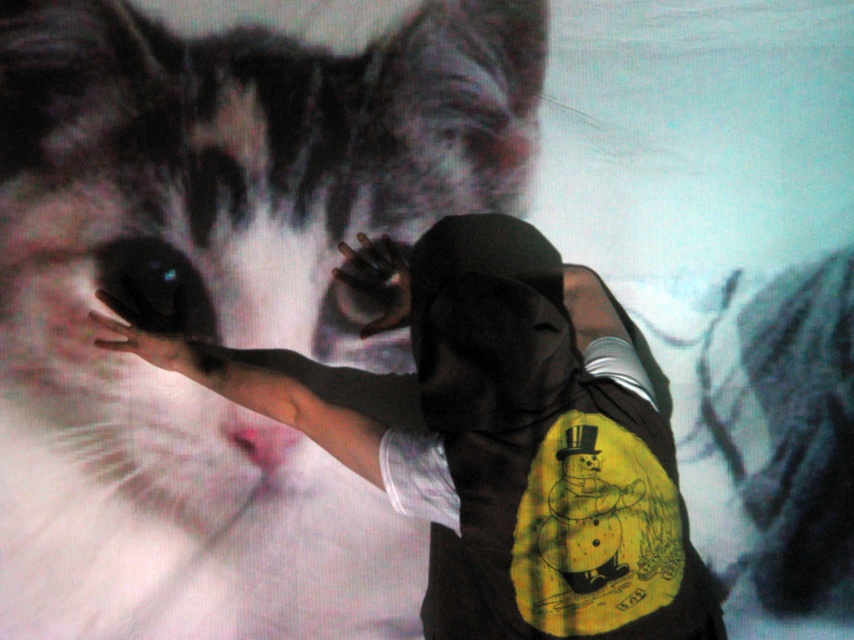
Question: Can you confirm if black matte hand at center is positioned to the right of black matte glove at center?

Choices:
 (A) no
 (B) yes

Answer: (B)

Question: Can you confirm if black matte hand at center is positioned to the left of black matte glove at center?

Choices:
 (A) no
 (B) yes

Answer: (A)

Question: Considering the real-world distances, which object is closest to the gray textured fur at upper right?

Choices:
 (A) black matte t-shirt at center
 (B) black matte glove at center

Answer: (A)

Question: Considering the relative positions of black matte t-shirt at center and black matte glove at center in the image provided, where is black matte t-shirt at center located with respect to black matte glove at center?

Choices:
 (A) right
 (B) left

Answer: (A)

Question: Which of the following is the farthest from the observer?

Choices:
 (A) black matte hand at center
 (B) gray textured fur at upper right
 (C) white fur cat at center

Answer: (A)

Question: Which point appears closest to the camera in this image?

Choices:
 (A) pos(665,584)
 (B) pos(341,301)

Answer: (A)